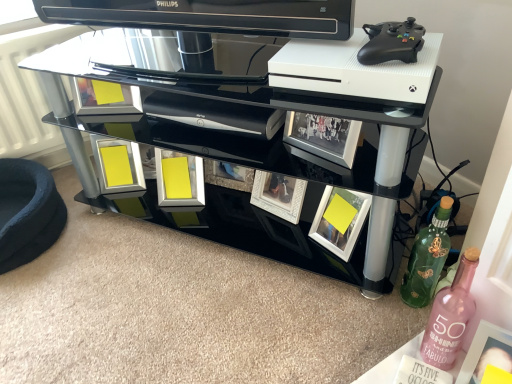
At what (x,y) coordinates should I click in order to perform the action: click on free space in front of metallic yellow picture frame at lower left, which appears as the 5th picture frame when viewed from the front. Please return your answer as a coordinate pair (x, y). This screenshot has width=512, height=384. Looking at the image, I should click on (116, 236).